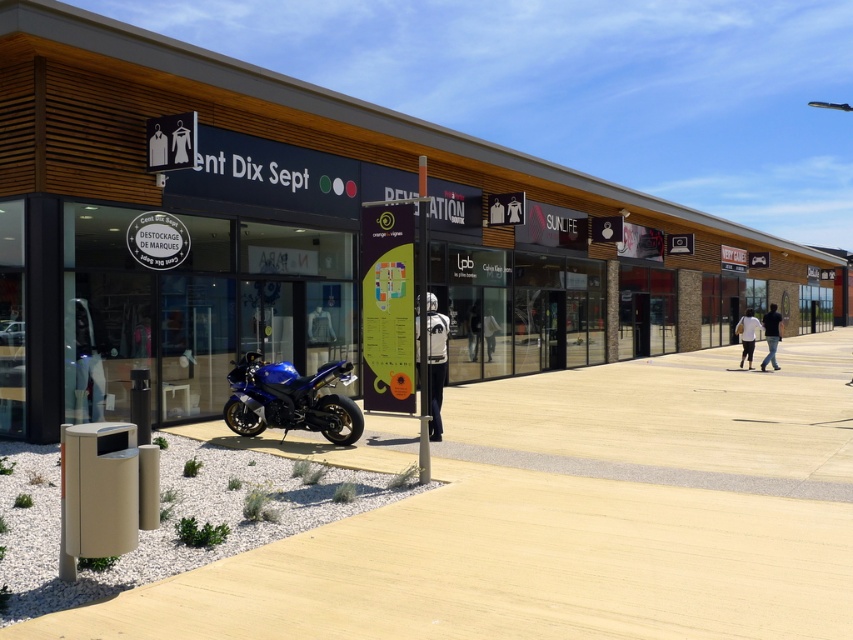
In the scene shown: Is matte wood mall at center bigger than beige concrete pavement at center?

Yes, matte wood mall at center is bigger than beige concrete pavement at center.

Is matte wood mall at center below beige concrete pavement at center?

Incorrect, matte wood mall at center is not positioned below beige concrete pavement at center.

The height and width of the screenshot is (640, 853). What are the coordinates of `matte wood mall at center` in the screenshot? It's located at (312, 234).

This screenshot has height=640, width=853. Identify the location of matte wood mall at center. (312, 234).

Does matte wood mall at center have a smaller size compared to blue metallic motorcycle at lower left?

Incorrect, matte wood mall at center is not smaller in size than blue metallic motorcycle at lower left.

Can you confirm if matte wood mall at center is taller than blue metallic motorcycle at lower left?

Correct, matte wood mall at center is much taller as blue metallic motorcycle at lower left.

Who is more distant from viewer, (489,157) or (345,432)?

Point (489,157)

You are a GUI agent. You are given a task and a screenshot of the screen. Output one action in this format:
    pyautogui.click(x=<x>, y=<y>)
    Task: Click on the matte wood mall at center
    The height and width of the screenshot is (640, 853).
    Given the screenshot: What is the action you would take?
    pyautogui.click(x=312, y=234)

Does beige concrete pavement at center appear on the right side of blue metallic motorcycle at lower left?

Yes, beige concrete pavement at center is to the right of blue metallic motorcycle at lower left.

Which is in front, point (838, 570) or point (361, 422)?

Point (838, 570) is more forward.

Image resolution: width=853 pixels, height=640 pixels. In order to click on beige concrete pavement at center in this screenshot , I will do `click(567, 518)`.